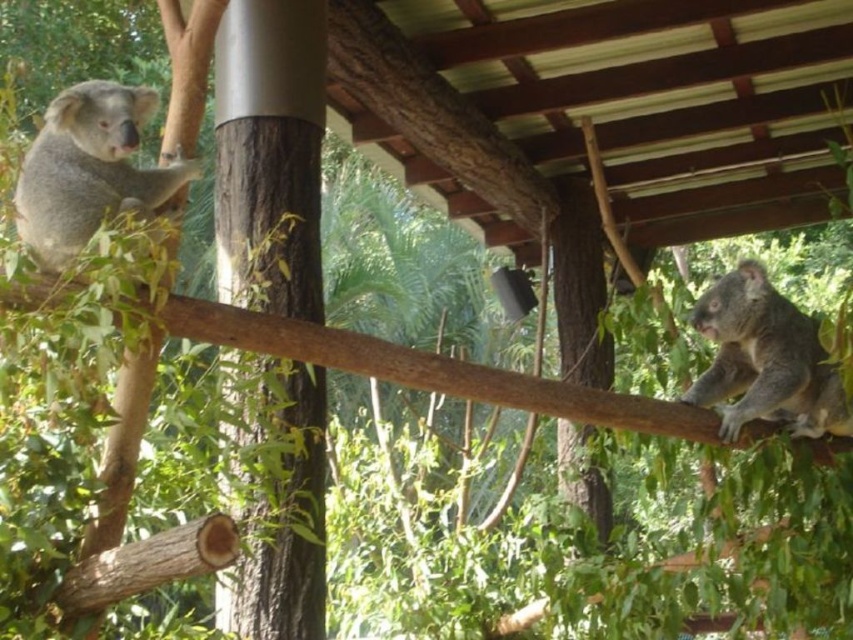
Is gray furry koala at upper left positioned in front of fuzzy gray koala at right?

Yes, gray furry koala at upper left is closer to the viewer.

Does gray furry koala at upper left have a smaller size compared to fuzzy gray koala at right?

Correct, gray furry koala at upper left occupies less space than fuzzy gray koala at right.

Is point (77, 113) closer to camera compared to point (699, 384)?

That is True.

I want to click on gray furry koala at upper left, so click(90, 168).